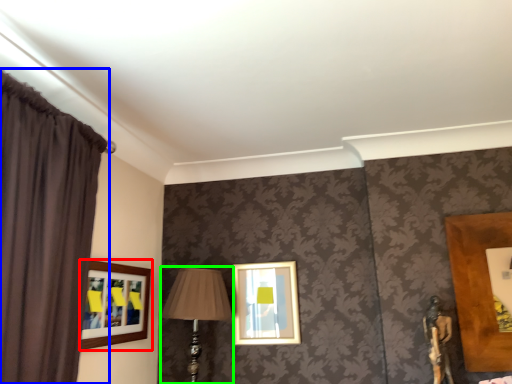
Question: Considering the real-world distances, which object is closest to picture frame (highlighted by a red box)? curtain (highlighted by a blue box) or table lamp (highlighted by a green box).

Choices:
 (A) curtain
 (B) table lamp

Answer: (B)